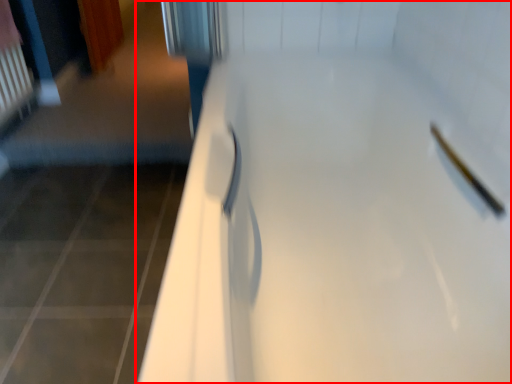
Question: From the image's perspective, where is door (annotated by the red box) located relative to shower?

Choices:
 (A) below
 (B) above

Answer: (A)